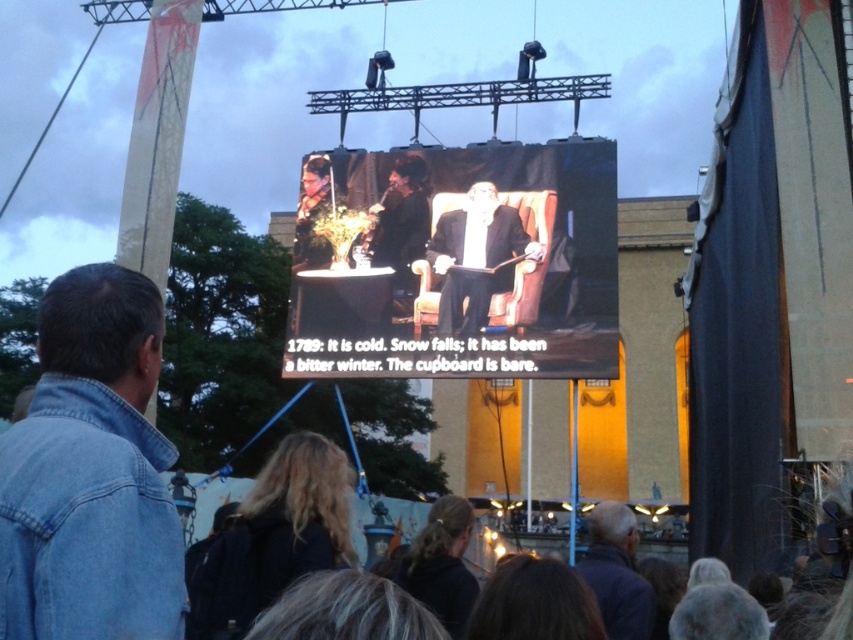
Question: Does smooth black suit at center appear over dark blue jacket at lower right?

Choices:
 (A) no
 (B) yes

Answer: (B)

Question: From the image, what is the correct spatial relationship of smooth black suit at center in relation to dark hair at lower center?

Choices:
 (A) left
 (B) right

Answer: (A)

Question: Among these objects, which one is farthest from the camera?

Choices:
 (A) dark blue jacket at lower right
 (B) denim jacket at lower left
 (C) dark hair at lower center
 (D) smooth black suit at center

Answer: (D)

Question: Which object is positioned closest to the matte black chair at center?

Choices:
 (A) denim jacket at lower left
 (B) smooth black suit at center

Answer: (B)

Question: Does dark blue jacket at lower right appear under dark hair at lower center?

Choices:
 (A) yes
 (B) no

Answer: (A)

Question: Among these objects, which one is nearest to the camera?

Choices:
 (A) dark hair at lower center
 (B) dark blue jacket at lower right

Answer: (A)